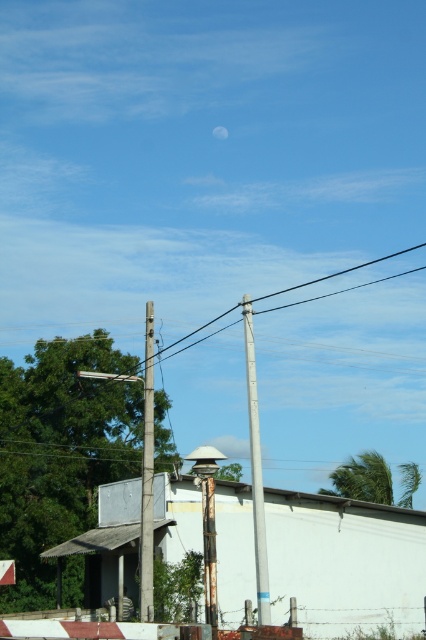
You are a painter standing at the base of the metallic gray telegraph pole at center. You want to paint the smooth gray pole at left but your ladder can only reach 2 meters. Can you reach it?

The metallic gray telegraph pole at center is 2.85 meters away from the smooth gray pole at left. Since your ladder can only reach 2 meters, you cannot reach the smooth gray pole at left from your current position.

You are standing in the field looking at the metallic gray telegraph pole at center and the smooth gray pole at left. Which pole would appear larger to you?

The metallic gray telegraph pole at center appears larger because it is closer to the viewer than the smooth gray pole at left.

You are an artist planning to sketch the scene. You want to ensure the metallic gray telegraph pole at center and the smooth gray pole at left are proportionally accurate. Which pole should you draw smaller to maintain the correct proportions?

The metallic gray teleograph pole at center should be drawn smaller than the smooth gray pole at left because it occupies less space according to the description.